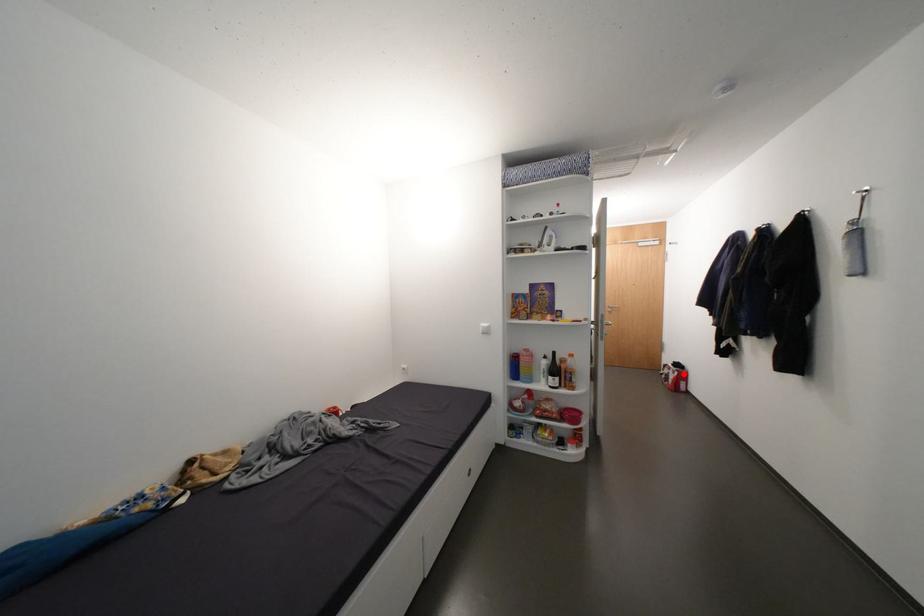
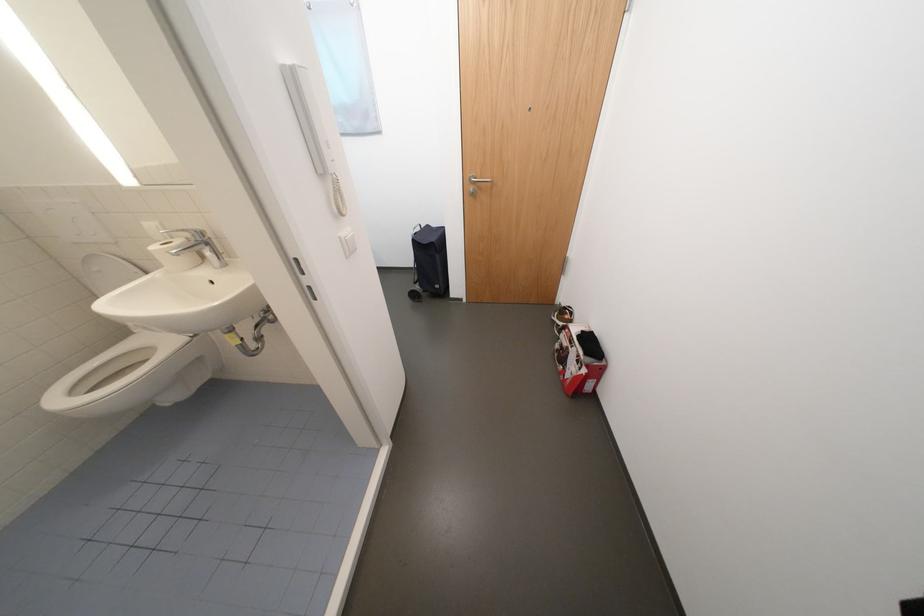
The point at the highlighted location is marked in the first image. Where is the corresponding point in the second image?

(592, 371)